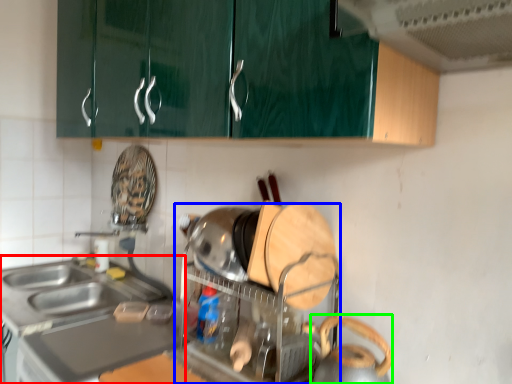
Question: Based on their relative distances, which object is farther from countertop (highlighted by a red box)? Choose from appliance (highlighted by a blue box) and appliance (highlighted by a green box).

Choices:
 (A) appliance
 (B) appliance

Answer: (B)